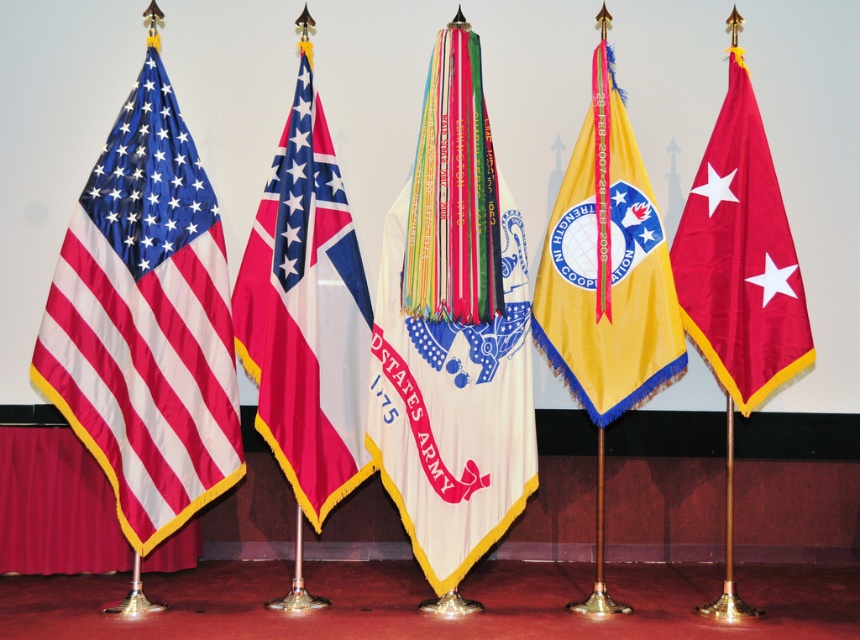
Question: Which point is farther from the camera taking this photo?

Choices:
 (A) (600, 49)
 (B) (452, 387)
 (C) (366, 307)
 (D) (775, 72)

Answer: (D)

Question: Is white fabric flag at center wider than polyester flag at center?

Choices:
 (A) no
 (B) yes

Answer: (B)

Question: Which point is closer to the camera?

Choices:
 (A) (65, 132)
 (B) (650, 371)

Answer: (B)

Question: Is polyester flag at center wider than matte red flag with white stars at right?

Choices:
 (A) no
 (B) yes

Answer: (B)

Question: Which point is closer to the camera?

Choices:
 (A) (699, 234)
 (B) (243, 308)

Answer: (B)

Question: Does matte fabric flag at left appear on the right side of matte red flag with white stars at right?

Choices:
 (A) yes
 (B) no

Answer: (B)